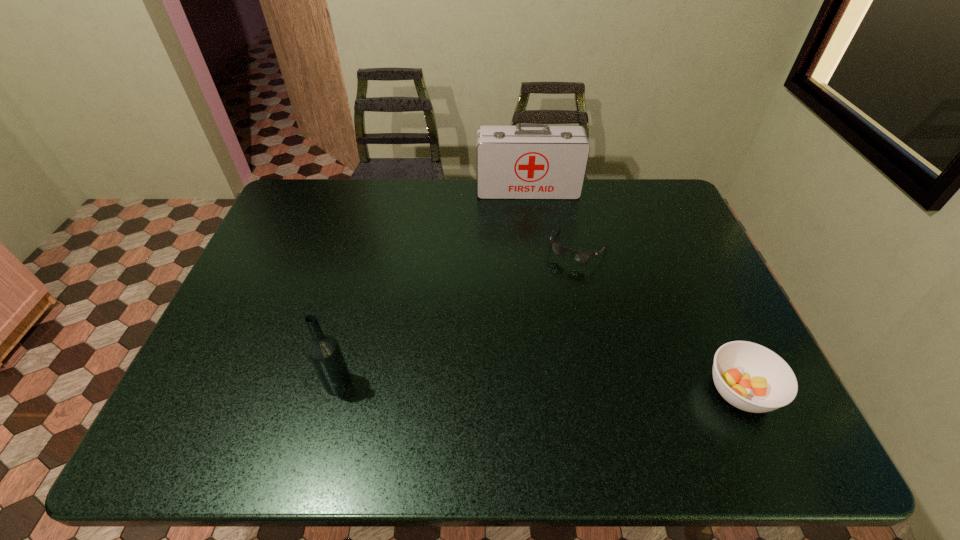
Locate an element on the screen. This screenshot has width=960, height=540. vodka is located at coordinates (325, 354).

Image resolution: width=960 pixels, height=540 pixels. I want to click on soup bowl, so click(751, 377).

Where is `the third tallest object`? This screenshot has width=960, height=540. the third tallest object is located at coordinates (751, 377).

I want to click on the shortest object, so click(x=579, y=256).

This screenshot has height=540, width=960. What are the coordinates of `the third nearest object` in the screenshot? It's located at (579, 256).

I want to click on the first-aid kit, so click(x=528, y=161).

Locate an element on the screen. The image size is (960, 540). vacant space located 0.290m on the back of the vodka is located at coordinates (363, 281).

Where is `vacant space located on the left of the soup bowl`? The image size is (960, 540). vacant space located on the left of the soup bowl is located at coordinates (629, 392).

Find the location of a particular element. The width and height of the screenshot is (960, 540). blank space located 0.300m on the front-facing side of the sunglasses is located at coordinates (523, 340).

Where is `free location located on the front-facing side of the sunglasses`? free location located on the front-facing side of the sunglasses is located at coordinates (554, 288).